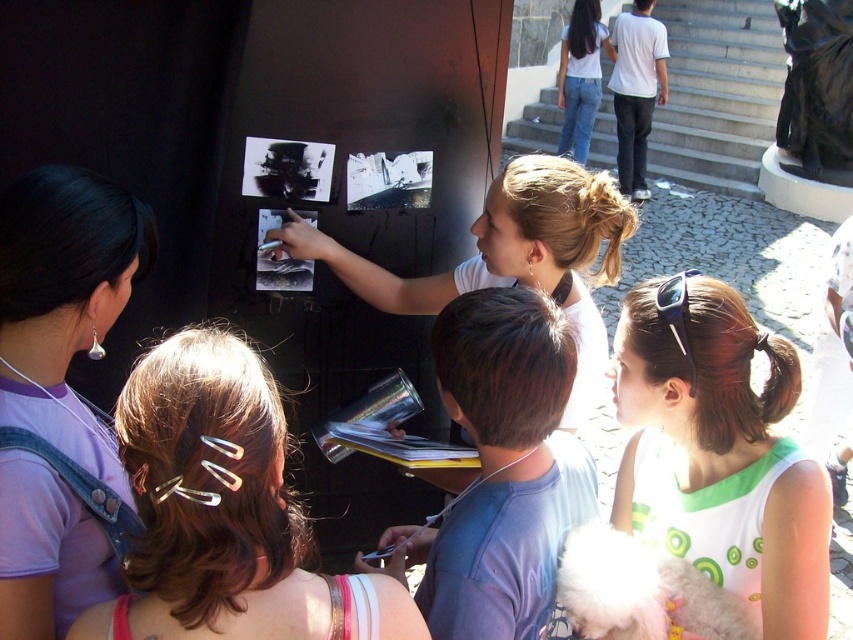
Which is in front, point (300, 515) or point (18, 497)?

Positioned in front is point (18, 497).

Is silver hair clips at upper left closer to the viewer compared to matte purple shirt at upper left?

Yes, silver hair clips at upper left is in front of matte purple shirt at upper left.

Describe the element at coordinates (224, 513) in the screenshot. I see `silver hair clips at upper left` at that location.

In order to click on silver hair clips at upper left in this screenshot , I will do `click(224, 513)`.

Between matte purple shirt at upper left and matte white shirt at center, which one has more height?

matte purple shirt at upper left

Is the position of matte purple shirt at upper left more distant than that of matte white shirt at center?

No, it is not.

Who is more forward, (61,184) or (383,280)?

Positioned in front is point (61,184).

The height and width of the screenshot is (640, 853). What are the coordinates of `matte purple shirt at upper left` in the screenshot? It's located at (64, 300).

Which of these two, white fabric at center or matte white shirt at center, stands taller?

matte white shirt at center is taller.

Image resolution: width=853 pixels, height=640 pixels. What do you see at coordinates (718, 451) in the screenshot? I see `white fabric at center` at bounding box center [718, 451].

Locate an element on the screen. The image size is (853, 640). white fabric at center is located at coordinates (718, 451).